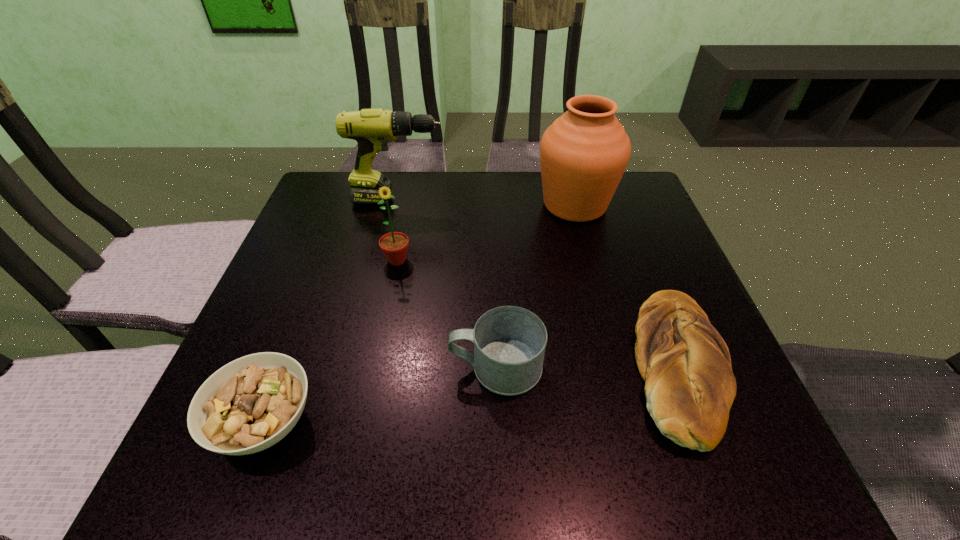
You are a GUI agent. You are given a task and a screenshot of the screen. Output one action in this format:
    pyautogui.click(x=<x>, y=<y>)
    Task: Click on the free spot between the bread and the drill
    The image size is (960, 540).
    Given the screenshot: What is the action you would take?
    pyautogui.click(x=539, y=282)

The height and width of the screenshot is (540, 960). Identify the location of vacant space that is in between the stew and the drill. (332, 311).

Locate an element on the screen. The height and width of the screenshot is (540, 960). free spot between the drill and the bread is located at coordinates (539, 282).

I want to click on blank region between the fourth nearest object and the bread, so click(x=538, y=313).

Locate an element on the screen. This screenshot has width=960, height=540. object that is the fifth closest to the bread is located at coordinates (248, 405).

The image size is (960, 540). In order to click on the closest object to the bread in this screenshot , I will do `click(509, 342)`.

You are a GUI agent. You are given a task and a screenshot of the screen. Output one action in this format:
    pyautogui.click(x=<x>, y=<y>)
    Task: Click on the vacant area that satisfies the following two spatial constraints: 1. on the handle side of the urn; 2. on the left side of the drill
    Image resolution: width=960 pixels, height=540 pixels.
    Given the screenshot: What is the action you would take?
    pyautogui.click(x=397, y=205)

The image size is (960, 540). I want to click on vacant region that satisfies the following two spatial constraints: 1. on the handle side of the drill; 2. on the back side of the bread, so tap(360, 364).

The image size is (960, 540). Identify the location of free point that satisfies the following two spatial constraints: 1. on the handle side of the urn; 2. on the left side of the drill. (397, 205).

Locate an element on the screen. This screenshot has height=540, width=960. free space that satisfies the following two spatial constraints: 1. on the handle side of the drill; 2. on the left side of the bread is located at coordinates (360, 364).